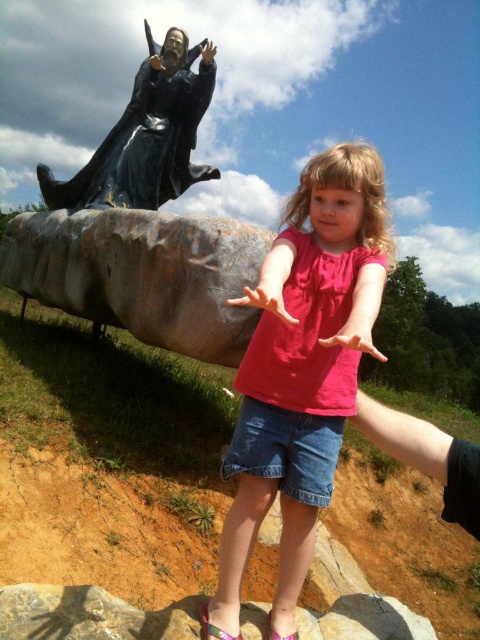
You are a photographer trying to capture the statue and the girl in the foreground. You notice two points in the scene labeled as point (x=156, y=248) and point (x=360, y=326). Which point is closer to your camera lens?

Point (x=156, y=248) is further to the camera than point (x=360, y=326), so the point closer to the camera lens is point (x=360, y=326).